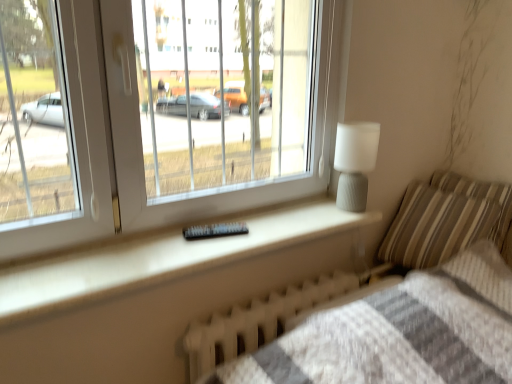
Measure the distance between point (271, 61) and camera.

They are 10.06 feet apart.

Image resolution: width=512 pixels, height=384 pixels. Describe the element at coordinates (486, 198) in the screenshot. I see `striped fabric pillow at right, arranged as the 1th pillow when viewed from the right` at that location.

You are a GUI agent. You are given a task and a screenshot of the screen. Output one action in this format:
    pyautogui.click(x=<x>, y=<y>)
    Task: Click on the striped fabric pillow at right, which is the second pillow from right to left
    
    Given the screenshot: What is the action you would take?
    pyautogui.click(x=446, y=220)

Is white matte lamp at upper right thinner than white plastic window at upper left?

Indeed, white matte lamp at upper right has a lesser width compared to white plastic window at upper left.

In the scene shown: What's the angular difference between white matte lamp at upper right and white plastic window at upper left's facing directions?

white matte lamp at upper right and white plastic window at upper left are facing 2.35 degrees away from each other.

Who is shorter, white matte lamp at upper right or white plastic window at upper left?

Standing shorter between the two is white matte lamp at upper right.

Which object is positioned more to the right, white matte lamp at upper right or white plastic window at upper left?

white matte lamp at upper right is more to the right.

Considering the positions of objects striped fabric pillow at right, arranged as the first pillow when viewed from the left, and striped fabric pillow at right, arranged as the 2th pillow when viewed from the left, in the image provided, who is behind, striped fabric pillow at right, arranged as the first pillow when viewed from the left, or striped fabric pillow at right, arranged as the 2th pillow when viewed from the left,?

striped fabric pillow at right, arranged as the 2th pillow when viewed from the left, is further away from the camera.

How far apart are striped fabric pillow at right, arranged as the first pillow when viewed from the left, and striped fabric pillow at right, arranged as the 1th pillow when viewed from the right?

They are 3.79 inches apart.

Considering the points (467, 236) and (468, 182), which point is behind, point (467, 236) or point (468, 182)?

The point (468, 182) is behind.

Can you confirm if striped fabric pillow at right, arranged as the first pillow when viewed from the left, is smaller than striped fabric pillow at right, arranged as the 2th pillow when viewed from the left?

Actually, striped fabric pillow at right, arranged as the first pillow when viewed from the left, might be larger than striped fabric pillow at right, arranged as the 2th pillow when viewed from the left.

Identify the location of radiator below the white matte lamp at upper right (from the image's perspective). This screenshot has height=384, width=512. (273, 316).

Which is in front, point (264, 340) or point (341, 197)?

Positioned in front is point (264, 340).

Visually, is white textured radiator at lower center positioned to the left or to the right of white matte lamp at upper right?

From the image, it's evident that white textured radiator at lower center is to the left of white matte lamp at upper right.

Can you tell me how much white textured radiator at lower center and white matte lamp at upper right differ in facing direction?

2.47 degrees.

Which is behind, striped fabric pillow at right, which is the second pillow from right to left, or white textured radiator at lower center?

striped fabric pillow at right, which is the second pillow from right to left, is further from the camera.

What's the angular difference between striped fabric pillow at right, which is the second pillow from right to left, and white textured radiator at lower center's facing directions?

The angle between the facing direction of striped fabric pillow at right, which is the second pillow from right to left, and the facing direction of white textured radiator at lower center is 80.1 degrees.

From the image's perspective, is striped fabric pillow at right, arranged as the first pillow when viewed from the left, positioned above or below white textured radiator at lower center?

Clearly, from the image's perspective, striped fabric pillow at right, arranged as the first pillow when viewed from the left, is above white textured radiator at lower center.

Considering the relative sizes of striped fabric pillow at right, which is the second pillow from right to left, and white textured radiator at lower center in the image provided, is striped fabric pillow at right, which is the second pillow from right to left, wider than white textured radiator at lower center?

Yes.

Considering the sizes of objects white matte lamp at upper right and striped fabric pillow at right, which is the second pillow from right to left, in the image provided, who is shorter, white matte lamp at upper right or striped fabric pillow at right, which is the second pillow from right to left,?

white matte lamp at upper right.

Considering the relative positions of white matte lamp at upper right and striped fabric pillow at right, which is the second pillow from right to left, in the image provided, is white matte lamp at upper right to the left of striped fabric pillow at right, which is the second pillow from right to left, from the viewer's perspective?

Correct, you'll find white matte lamp at upper right to the left of striped fabric pillow at right, which is the second pillow from right to left.

Identify the location of table lamp in front of the striped fabric pillow at right, which is the second pillow from right to left. (355, 163).

Who is smaller, white matte lamp at upper right or striped fabric pillow at right, arranged as the first pillow when viewed from the left?

Smaller between the two is white matte lamp at upper right.

Which object is further away from the camera taking this photo, white textured radiator at lower center or striped fabric pillow at right, arranged as the 1th pillow when viewed from the right?

Positioned behind is striped fabric pillow at right, arranged as the 1th pillow when viewed from the right.

From the image's perspective, is white textured radiator at lower center located above or below striped fabric pillow at right, arranged as the 2th pillow when viewed from the left?

From the image's perspective, white textured radiator at lower center appears below striped fabric pillow at right, arranged as the 2th pillow when viewed from the left.

From the picture: Considering the positions of objects white textured radiator at lower center and striped fabric pillow at right, arranged as the 2th pillow when viewed from the left, in the image provided, who is more to the left, white textured radiator at lower center or striped fabric pillow at right, arranged as the 2th pillow when viewed from the left,?

From the viewer's perspective, white textured radiator at lower center appears more on the left side.

Looking at the image, does white plastic window at upper left seem bigger or smaller compared to striped fabric pillow at right, arranged as the 1th pillow when viewed from the right?

In the image, white plastic window at upper left appears to be larger than striped fabric pillow at right, arranged as the 1th pillow when viewed from the right.

From a real-world perspective, who is located lower, white plastic window at upper left or striped fabric pillow at right, arranged as the 1th pillow when viewed from the right?

striped fabric pillow at right, arranged as the 1th pillow when viewed from the right, from a real-world perspective.

From the image's perspective, relative to striped fabric pillow at right, arranged as the 2th pillow when viewed from the left, is white plastic window at upper left above or below?

Based on their image positions, white plastic window at upper left is located above striped fabric pillow at right, arranged as the 2th pillow when viewed from the left.

Is white plastic window at upper left placed right next to striped fabric pillow at right, arranged as the 2th pillow when viewed from the left?

No, white plastic window at upper left is not in contact with striped fabric pillow at right, arranged as the 2th pillow when viewed from the left.

I want to click on window above the white matte lamp at upper right (from a real-world perspective), so click(x=172, y=117).

Image resolution: width=512 pixels, height=384 pixels. In order to click on pillow that appears behind the striped fabric pillow at right, which is the second pillow from right to left in this screenshot , I will do `click(486, 198)`.

Considering their positions, is white plastic window at upper left positioned further to white textured radiator at lower center than striped fabric pillow at right, arranged as the first pillow when viewed from the left?

white plastic window at upper left is further to white textured radiator at lower center.

Estimate the real-world distances between objects in this image. Which object is closer to white plastic window at upper left, striped fabric pillow at right, arranged as the first pillow when viewed from the left, or white textured radiator at lower center?

striped fabric pillow at right, arranged as the first pillow when viewed from the left, is positioned closer to the anchor white plastic window at upper left.

Looking at the image, which one is located closer to white matte lamp at upper right, striped fabric pillow at right, arranged as the 2th pillow when viewed from the left, or white plastic window at upper left?

The object closer to white matte lamp at upper right is striped fabric pillow at right, arranged as the 2th pillow when viewed from the left.

From the image, which object appears to be nearer to white matte lamp at upper right, white textured radiator at lower center or striped fabric pillow at right, arranged as the 2th pillow when viewed from the left?

white textured radiator at lower center is positioned closer to the anchor white matte lamp at upper right.

From the image, which object appears to be nearer to white matte lamp at upper right, white textured radiator at lower center or white plastic window at upper left?

Based on the image, white textured radiator at lower center appears to be nearer to white matte lamp at upper right.

Considering their positions, is white matte lamp at upper right positioned further to striped fabric pillow at right, arranged as the 2th pillow when viewed from the left, than white plastic window at upper left?

white plastic window at upper left is further to striped fabric pillow at right, arranged as the 2th pillow when viewed from the left.

Which object lies nearer to the anchor point white plastic window at upper left, striped fabric pillow at right, arranged as the 1th pillow when viewed from the right, or white matte lamp at upper right?

white matte lamp at upper right is positioned closer to the anchor white plastic window at upper left.

Estimate the real-world distances between objects in this image. Which object is closer to white matte lamp at upper right, striped fabric pillow at right, arranged as the first pillow when viewed from the left, or white textured radiator at lower center?

Based on the image, striped fabric pillow at right, arranged as the first pillow when viewed from the left, appears to be nearer to white matte lamp at upper right.

Where is `table lamp between white plastic window at upper left and white textured radiator at lower center from top to bottom`? This screenshot has height=384, width=512. table lamp between white plastic window at upper left and white textured radiator at lower center from top to bottom is located at coordinates (355, 163).

You are a GUI agent. You are given a task and a screenshot of the screen. Output one action in this format:
    pyautogui.click(x=<x>, y=<y>)
    Task: Click on the table lamp between white textured radiator at lower center and striped fabric pillow at right, arranged as the 1th pillow when viewed from the right, from left to right
    The image size is (512, 384).
    Given the screenshot: What is the action you would take?
    pyautogui.click(x=355, y=163)

At what (x,y) coordinates should I click in order to perform the action: click on pillow between white plastic window at upper left and striped fabric pillow at right, arranged as the 1th pillow when viewed from the right. Please return your answer as a coordinate pair (x, y). The height and width of the screenshot is (384, 512). Looking at the image, I should click on (446, 220).

You are a GUI agent. You are given a task and a screenshot of the screen. Output one action in this format:
    pyautogui.click(x=<x>, y=<y>)
    Task: Click on the radiator between white plastic window at upper left and striped fabric pillow at right, arranged as the 2th pillow when viewed from the left, in the horizontal direction
    
    Given the screenshot: What is the action you would take?
    pos(273,316)